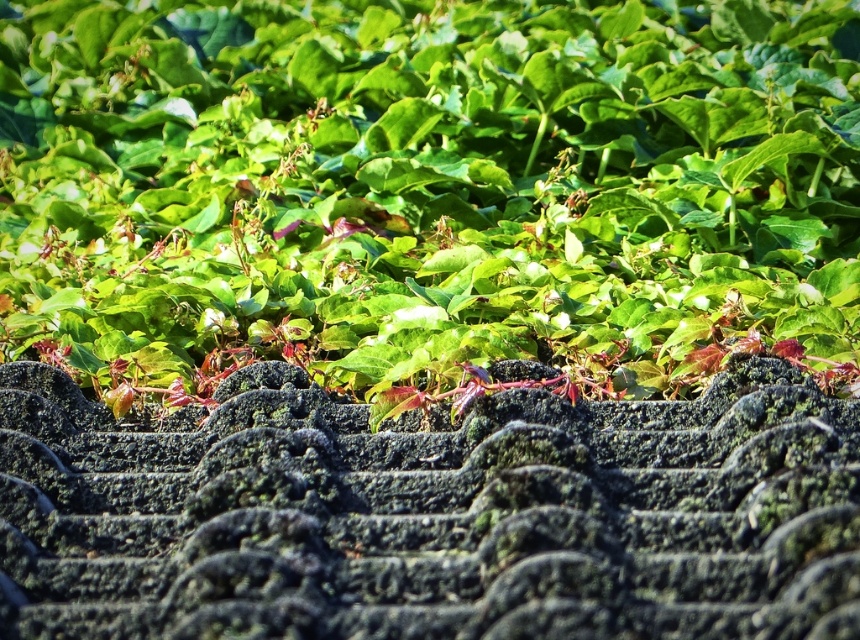
Can you confirm if green leafy plant at upper center is positioned to the right of green mossy roof tiles at upper center?

In fact, green leafy plant at upper center is to the left of green mossy roof tiles at upper center.

Does green leafy plant at upper center come behind green mossy roof tiles at upper center?

That is True.

Does point (502, 262) come behind point (685, 513)?

Yes, point (502, 262) is behind point (685, 513).

At what (x,y) coordinates should I click in order to perform the action: click on green leafy plant at upper center. Please return your answer as a coordinate pair (x, y). This screenshot has width=860, height=640. Looking at the image, I should click on (428, 189).